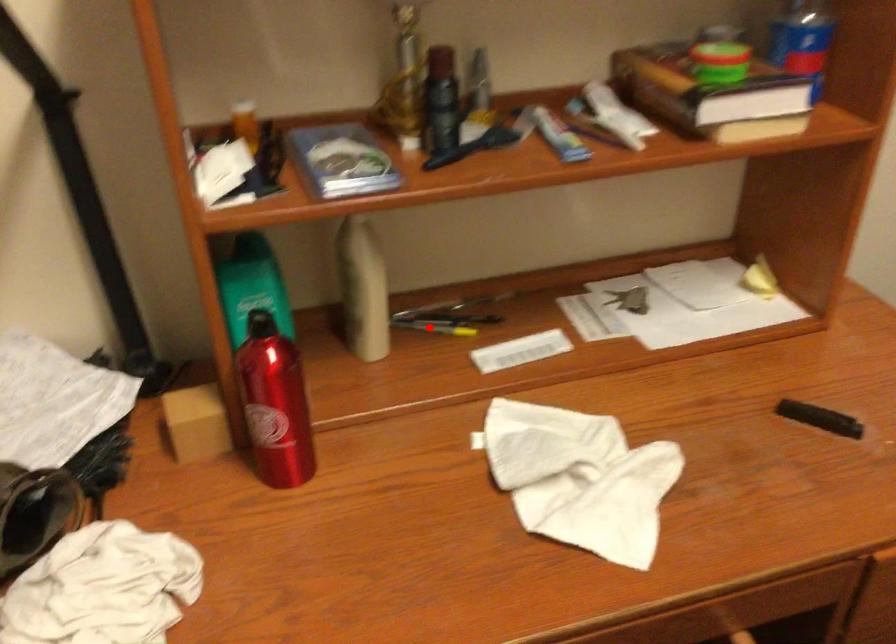
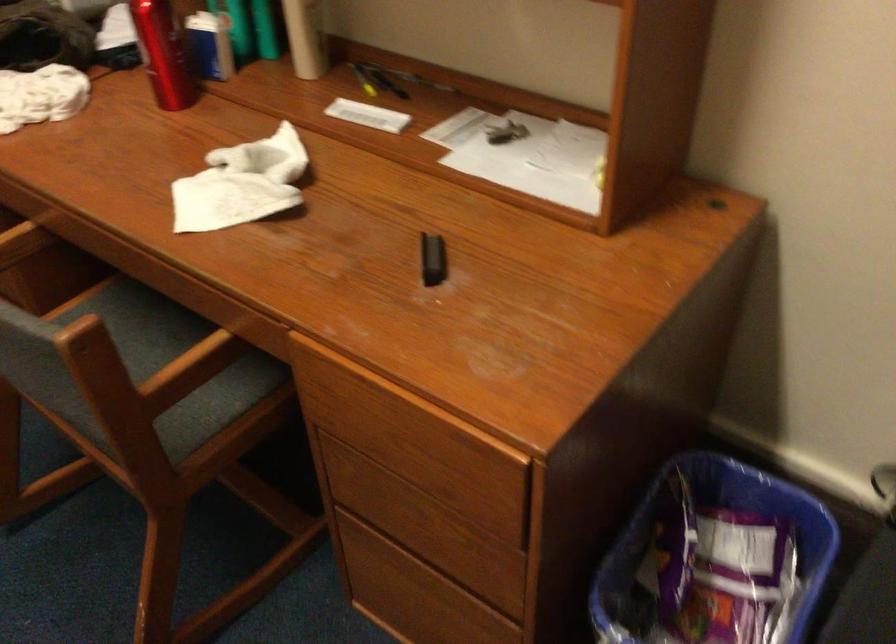
The point at the highlighted location is marked in the first image. Where is the corresponding point in the second image?

(363, 80)